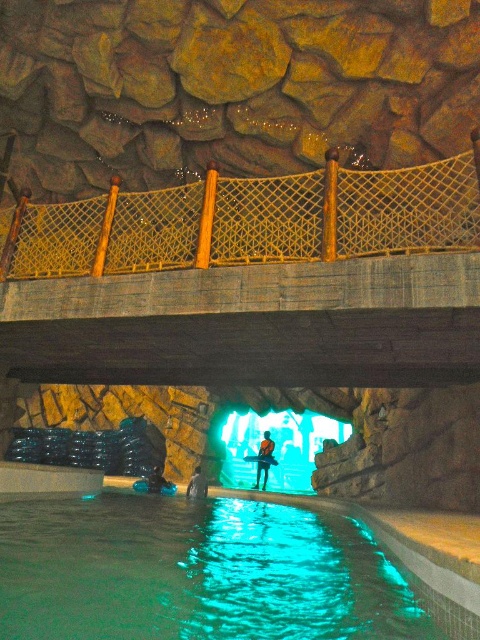
You are standing on the wooden bridge with a netted railing and looking down at the blue rubber boots at lower center and the blue fabric person at lower center in the water below. Which object is wider?

The blue fabric person at lower center is wider than the blue rubber boots at lower center because the blue rubber boots at lower center has a smaller width.

You are standing at the wooden bridge with a netted railing and want to look down at the two points in the cave below. Which point, point (269,449) or point (201,476), is closer to your current position on the bridge?

Point (269,449) is further to the camera than point (201,476), so the closer point to your position on the bridge would be point (201,476).